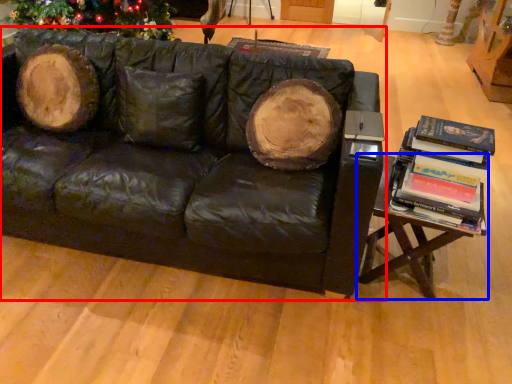
Question: Which point is closer to the camera, studio couch (highlighted by a red box) or table (highlighted by a blue box)?

Choices:
 (A) studio couch
 (B) table

Answer: (A)